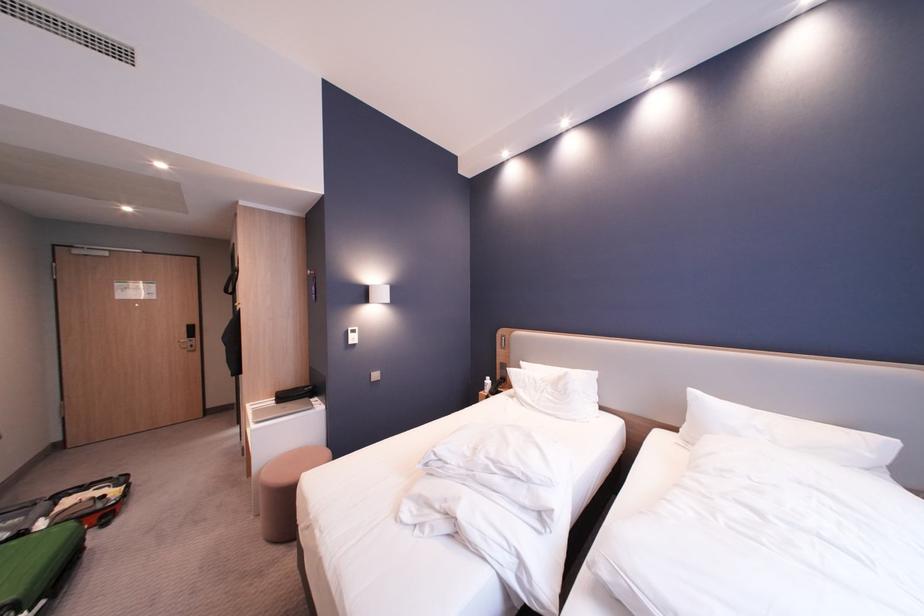
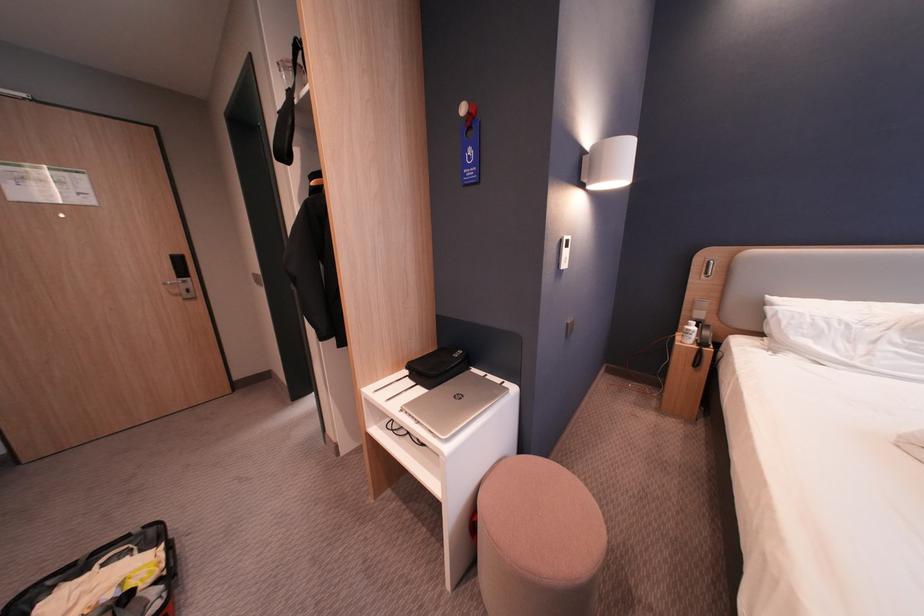
Where in the second image is the point corresponding to the point at 99,490 from the first image?

(99, 572)